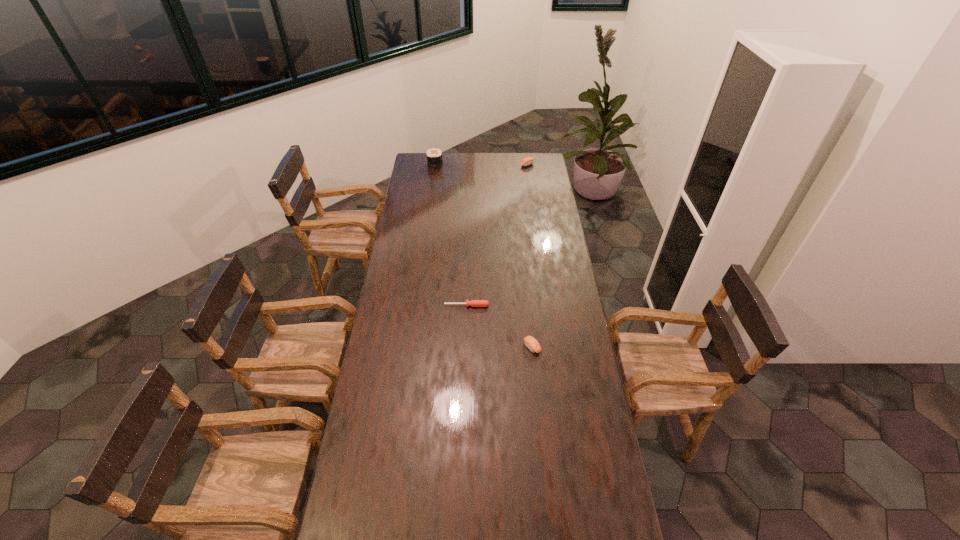
This screenshot has height=540, width=960. Find the location of `the tallest object`. the tallest object is located at coordinates (434, 156).

Locate an element on the screen. This screenshot has height=540, width=960. the leftmost object is located at coordinates (434, 156).

Where is `the second tallest sushi`? the second tallest sushi is located at coordinates (527, 161).

The image size is (960, 540). What are the coordinates of `the third shortest object` in the screenshot? It's located at (527, 161).

Identify the location of the nearest sushi. (531, 343).

At what (x,y) coordinates should I click in order to perform the action: click on the nearest object. Please return your answer as a coordinate pair (x, y). This screenshot has height=540, width=960. Looking at the image, I should click on (531, 343).

The width and height of the screenshot is (960, 540). Identify the location of the third farthest object. (474, 303).

You are a GUI agent. You are given a task and a screenshot of the screen. Output one action in this format:
    pyautogui.click(x=<x>, y=<y>)
    Task: Click on the shortest object
    This screenshot has width=960, height=540.
    Given the screenshot: What is the action you would take?
    pyautogui.click(x=474, y=303)

This screenshot has height=540, width=960. In order to click on vacant space located 0.280m on the right of the leftmost object in this screenshot , I will do pos(488,165).

This screenshot has height=540, width=960. Find the location of `vacant area situated on the left of the second shortest sushi`. vacant area situated on the left of the second shortest sushi is located at coordinates (504, 165).